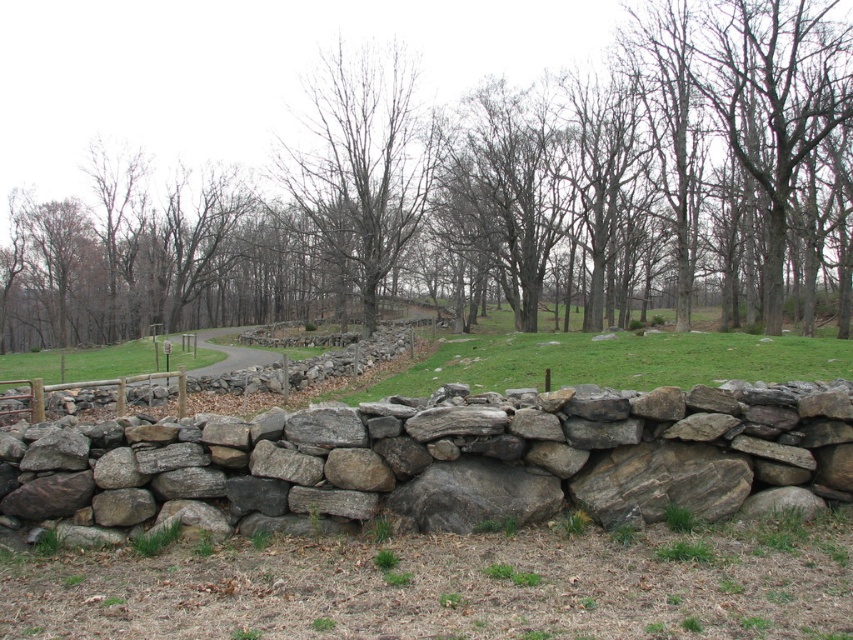
Question: Which point is farther to the camera?

Choices:
 (A) (708, 221)
 (B) (347, 456)

Answer: (A)

Question: Considering the relative positions of smooth bark tree at center and natural stone wall at center in the image provided, where is smooth bark tree at center located with respect to natural stone wall at center?

Choices:
 (A) below
 (B) above

Answer: (B)

Question: Which of these objects is positioned farthest from the bare wood tree at center?

Choices:
 (A) smooth bark tree at center
 (B) natural stone wall at center

Answer: (B)

Question: Where is natural stone wall at center located in relation to bare wood tree at center in the image?

Choices:
 (A) above
 (B) below

Answer: (B)

Question: Is smooth bark tree at center below natural stone wall at center?

Choices:
 (A) no
 (B) yes

Answer: (A)

Question: Which object is closer to the camera taking this photo?

Choices:
 (A) smooth bark tree at center
 (B) natural stone wall at center
 (C) bare wood tree at center

Answer: (B)